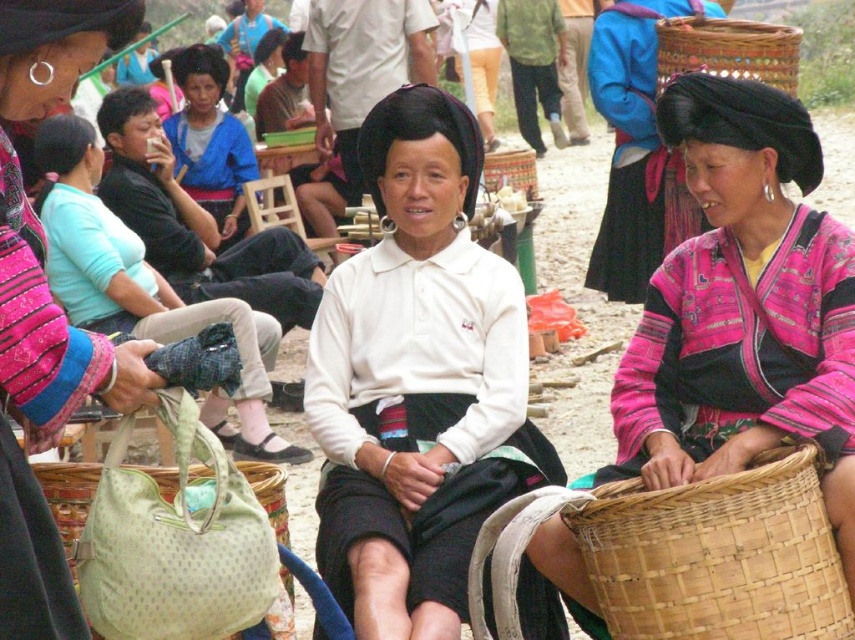
Question: Which point appears farthest from the camera in this image?

Choices:
 (A) (746, 604)
 (B) (775, 65)
 (C) (211, 172)

Answer: (C)

Question: Among these objects, which one is nearest to the camera?

Choices:
 (A) white matte shirt at center
 (B) woven bamboo basket at lower right
 (C) woven bamboo basket at upper right

Answer: (B)

Question: Considering the real-world distances, which object is farthest from the pink woven fabric at center?

Choices:
 (A) woven bamboo basket at lower right
 (B) woven bamboo basket at upper right
 (C) blue fabric shirt at center

Answer: (C)

Question: Does white matte shirt at center have a smaller size compared to light green fabric bag at lower left?

Choices:
 (A) no
 (B) yes

Answer: (A)

Question: Can you confirm if blue fabric shirt at center is positioned to the right of light green fabric bag at lower left?

Choices:
 (A) no
 (B) yes

Answer: (A)

Question: Is white matte shirt at center in front of woven bamboo basket at upper right?

Choices:
 (A) no
 (B) yes

Answer: (B)